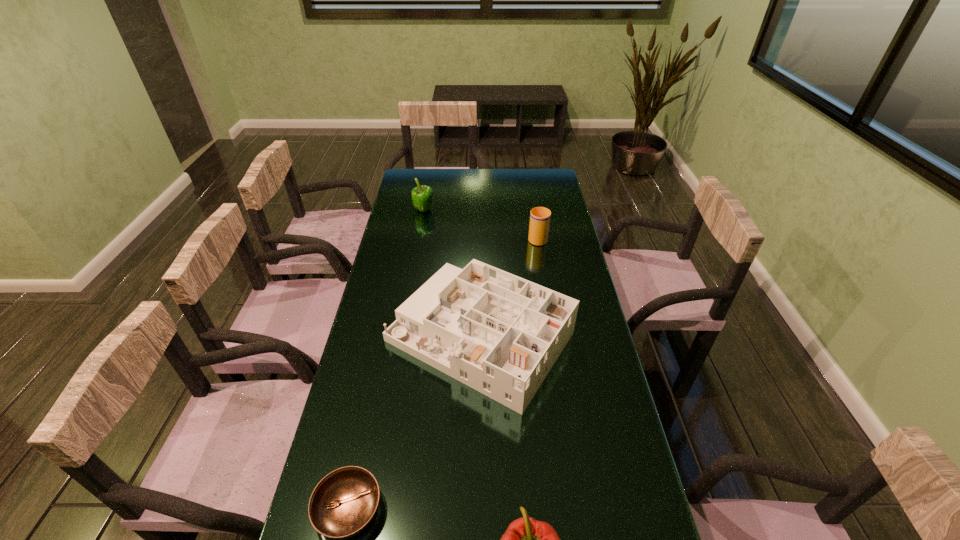
Select which object is the third closest to the cup. Please provide its 2D coordinates. Your answer should be formatted as a tuple, i.e. [(x, y)], where the tuple contains the x and y coordinates of a point satisfying the conditions above.

[(344, 502)]

Locate which object ranks in proximity to the shortest object. Please provide its 2D coordinates. Your answer should be formatted as a tuple, i.e. [(x, y)], where the tuple contains the x and y coordinates of a point satisfying the conditions above.

[(500, 334)]